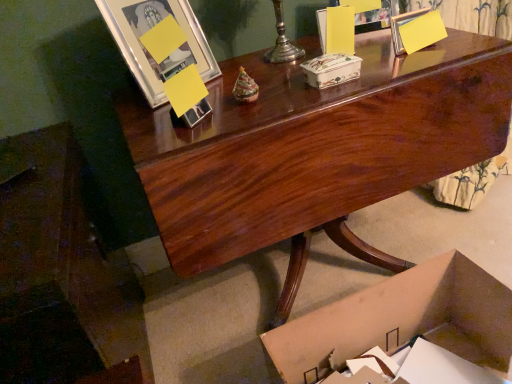
The height and width of the screenshot is (384, 512). I want to click on vacant space behind porcelain floral box at center, the second box when ordered from bottom to top, so click(302, 61).